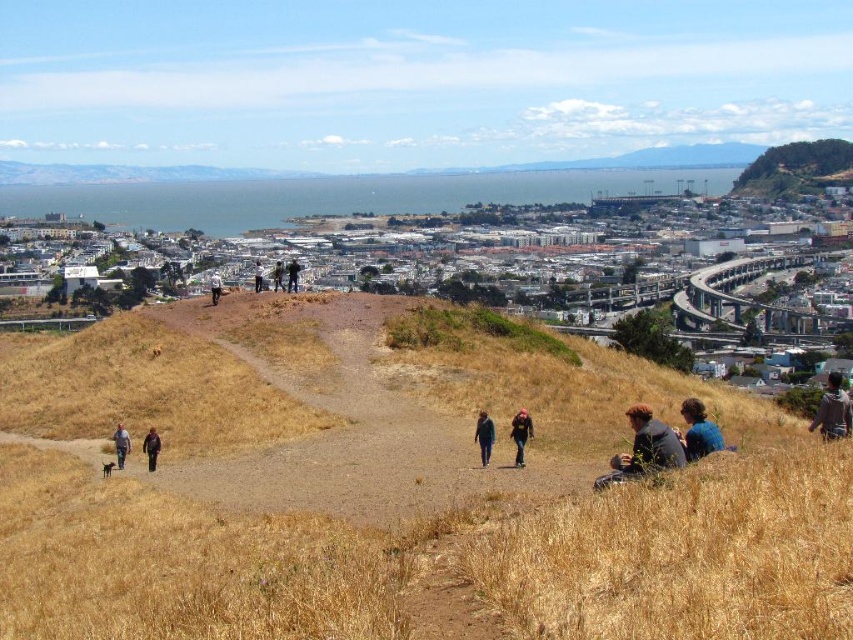
Question: Which object is the closest to the blue fabric at lower right?

Choices:
 (A) brown leather jacket at upper center
 (B) dry grass at center
 (C) gray fabric jacket at lower left

Answer: (B)

Question: Where is brown textured jacket at lower right located in relation to blue fabric at lower right in the image?

Choices:
 (A) right
 (B) left

Answer: (A)

Question: Among these points, which one is nearest to the camera?

Choices:
 (A) (647, 413)
 (B) (296, 273)

Answer: (A)

Question: Does dry grass at center have a smaller size compared to dark blue jeans at center?

Choices:
 (A) no
 (B) yes

Answer: (A)

Question: Which object is closer to the camera taking this photo?

Choices:
 (A) dry grass at center
 (B) blue fabric at lower right
 (C) white cotton shirt at center
 (D) brown leather jacket at upper center

Answer: (A)

Question: Can you confirm if white cotton shirt at center is wider than black cotton jacket at center?

Choices:
 (A) yes
 (B) no

Answer: (A)